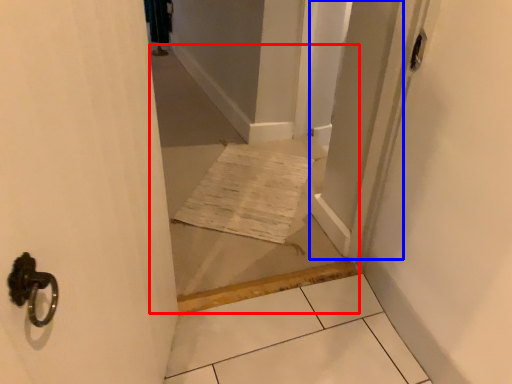
Question: Which point is closer to the camera, corridor (highlighted by a red box) or screen door (highlighted by a blue box)?

Choices:
 (A) corridor
 (B) screen door

Answer: (A)